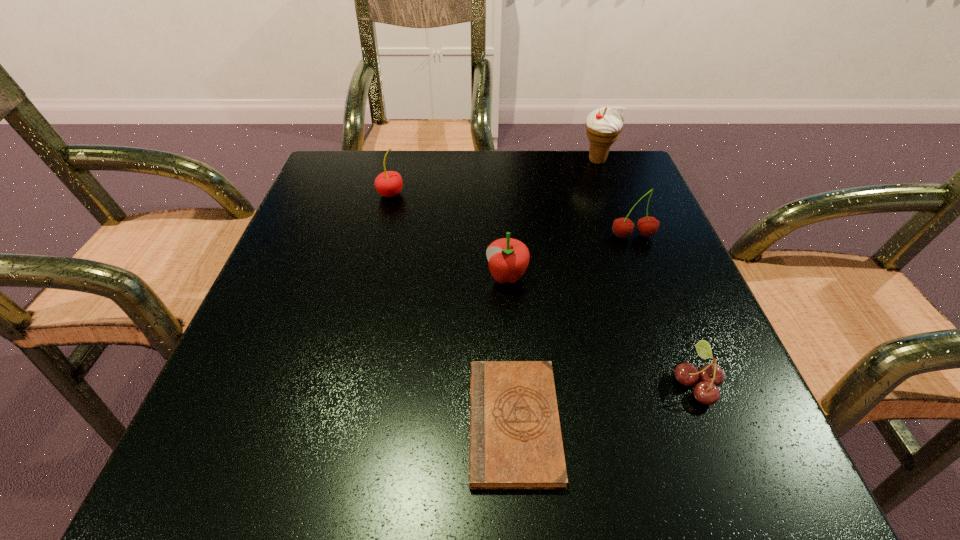
Where is `the farthest object`? The width and height of the screenshot is (960, 540). the farthest object is located at coordinates tap(604, 125).

Image resolution: width=960 pixels, height=540 pixels. Identify the location of icecream. (604, 125).

What are the coordinates of `the leftmost cherry` in the screenshot? It's located at (389, 183).

Image resolution: width=960 pixels, height=540 pixels. In order to click on the second farthest object in this screenshot , I will do `click(389, 183)`.

In order to click on the third farthest object in this screenshot , I will do pos(647,226).

I want to click on apple, so click(x=508, y=258).

Identify the location of the third nearest object. (508, 258).

At what (x,y) coordinates should I click in order to perform the action: click on the fifth tallest object. Please return your answer as a coordinate pair (x, y). The width and height of the screenshot is (960, 540). Looking at the image, I should click on (711, 376).

Image resolution: width=960 pixels, height=540 pixels. I want to click on the nearest cherry, so click(711, 376).

I want to click on the shortest object, so click(515, 442).